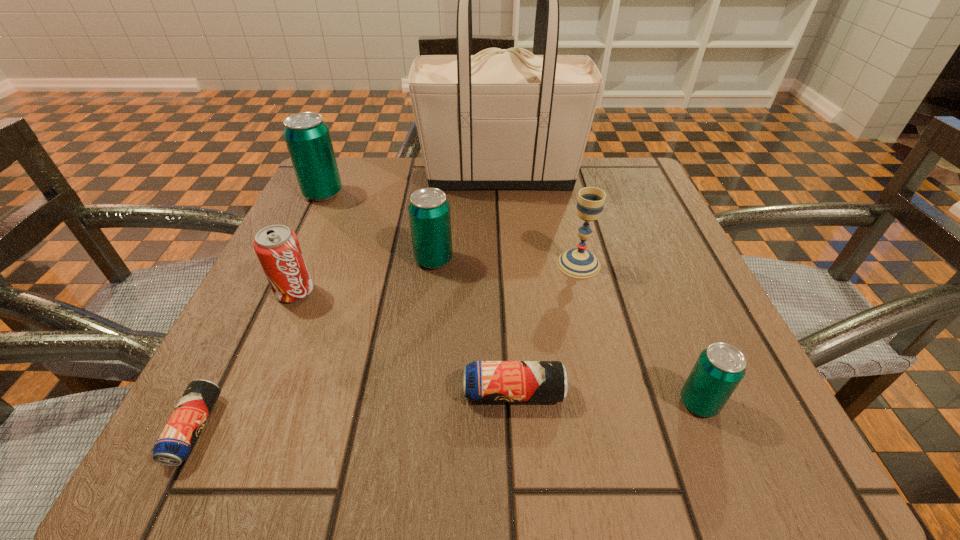
Locate an element on the screen. The image size is (960, 540). vacant area at the far right corner is located at coordinates (635, 203).

At what (x,y) coordinates should I click in order to perform the action: click on blank space at the near right corner of the desktop. Please return your answer as a coordinate pair (x, y). The image size is (960, 540). Looking at the image, I should click on (723, 471).

Image resolution: width=960 pixels, height=540 pixels. I want to click on vacant area that lies between the farthest teal beer can and the fourth nearest beer can, so click(378, 227).

Locate an element on the screen. The width and height of the screenshot is (960, 540). vacant space that is in between the biggest teal beer can and the smallest teal beer can is located at coordinates (511, 298).

The width and height of the screenshot is (960, 540). Identify the location of free space between the farthest beer can and the gray shopping bag. [412, 185].

At what (x,y) coordinates should I click in order to perform the action: click on free spot between the tallest object and the leftmost teal beer can. Please return your answer as a coordinate pair (x, y). Looking at the image, I should click on (412, 185).

Image resolution: width=960 pixels, height=540 pixels. Identify the location of free space between the second shortest object and the pink soda can. (404, 342).

Locate an element on the screen. This screenshot has height=540, width=960. vacant area that lies between the second tallest beer can and the farthest teal beer can is located at coordinates (378, 227).

Image resolution: width=960 pixels, height=540 pixels. Identify the location of free space between the rightmost teal beer can and the gray shopping bag. (600, 289).

Where is `free spot between the shopping bag and the smallest teal beer can`? The height and width of the screenshot is (540, 960). free spot between the shopping bag and the smallest teal beer can is located at coordinates (600, 289).